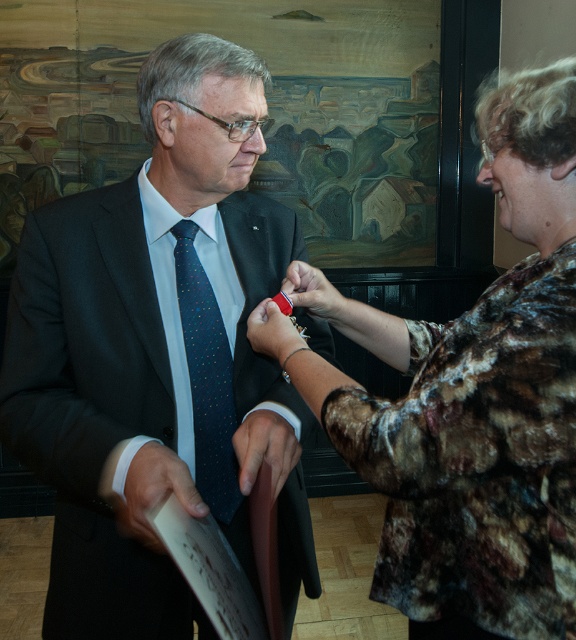
You are a photographer standing at a distance of 30 inches from the scene. You want to take a photo of the award ceremony. Is the point at coordinates point (514, 417) within your camera frame?

The distance of point (514, 417) from camera is 29.94 inches, which is slightly closer than your current position of 30 inches. Therefore, the point at coordinates point 0.653, 0.653 would be just inside the camera frame.

You are a photographer at an award ceremony. You need to ensure that the dark blue silk tie at center and the matte red pin at center are both visible in the photo. Based on their positions, which one is more likely to be obscured by the other?

The dark blue silk tie at center might be wider than matte red pin at center, so the dark blue silk tie at center could potentially obscure the matte red pin at center if positioned in front of it.